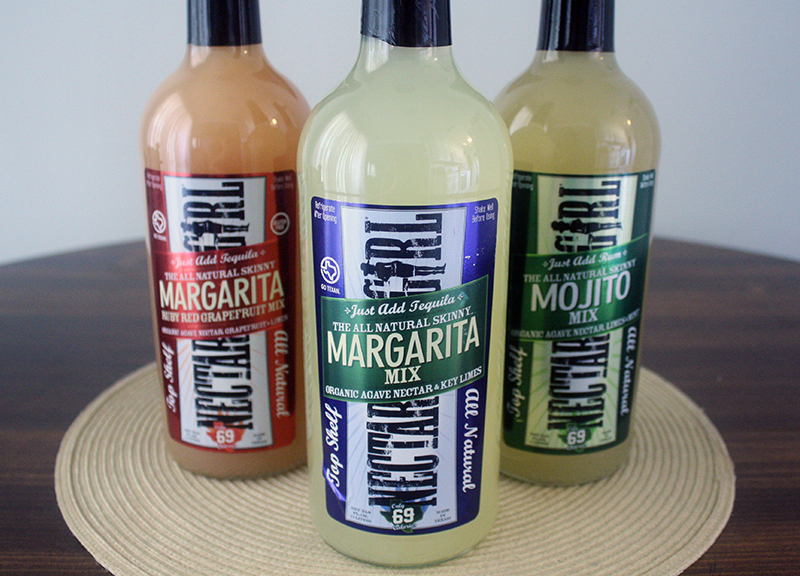
Identify the location of bottle. The image size is (800, 576). (x=202, y=374).